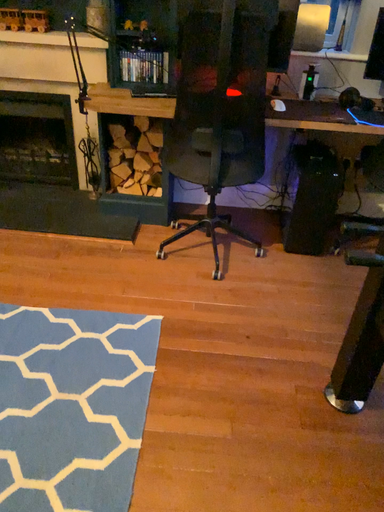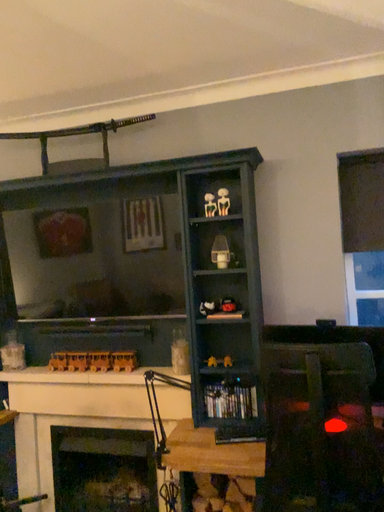
Question: Which way did the camera rotate in the video?

Choices:
 (A) rotated upward
 (B) rotated downward

Answer: (A)